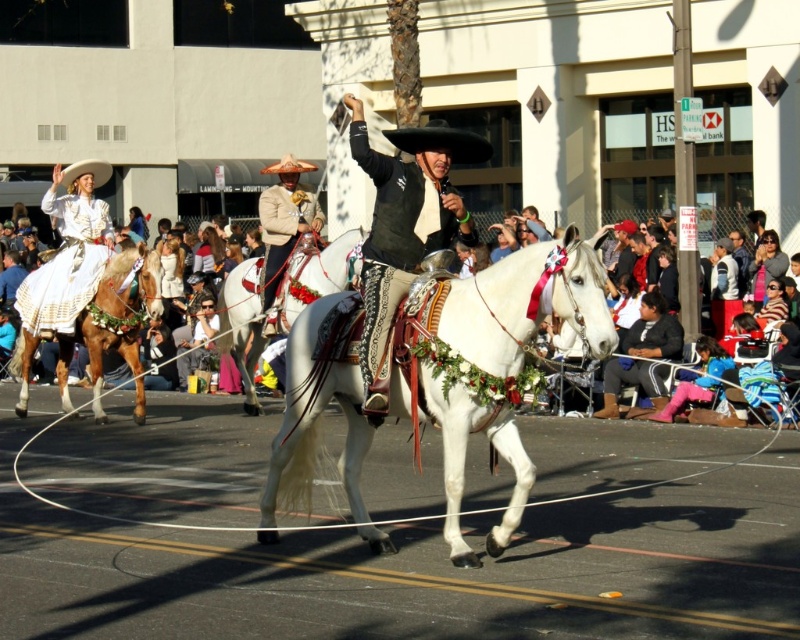
Can you confirm if black felt cowboy hat at center is shorter than brown felt cowboy hat at center?

Yes, black felt cowboy hat at center is shorter than brown felt cowboy hat at center.

Does black felt cowboy hat at center have a greater width compared to brown felt cowboy hat at center?

Incorrect, black felt cowboy hat at center's width does not surpass brown felt cowboy hat at center's.

The image size is (800, 640). What do you see at coordinates (441, 141) in the screenshot? I see `black felt cowboy hat at center` at bounding box center [441, 141].

This screenshot has height=640, width=800. In order to click on black felt cowboy hat at center in this screenshot , I will do `click(441, 141)`.

Does shiny black leather jacket at center have a greater width compared to pink fabric pants at lower right?

Incorrect, shiny black leather jacket at center's width does not surpass pink fabric pants at lower right's.

Who is positioned more to the left, shiny black leather jacket at center or pink fabric pants at lower right?

shiny black leather jacket at center is more to the left.

Which is behind, point (370, 364) or point (717, 369)?

Positioned behind is point (717, 369).

Find the location of a particular element. The height and width of the screenshot is (640, 800). shiny black leather jacket at center is located at coordinates (404, 227).

Looking at this image, is white glossy horse at center smaller than beige fabric hat at center?

Actually, white glossy horse at center might be larger than beige fabric hat at center.

Does white glossy horse at center have a lesser width compared to beige fabric hat at center?

Incorrect, white glossy horse at center's width is not less than beige fabric hat at center's.

Which is behind, point (448, 280) or point (272, 284)?

The point (272, 284) is more distant.

Image resolution: width=800 pixels, height=640 pixels. What are the coordinates of `white glossy horse at center` in the screenshot? It's located at (490, 362).